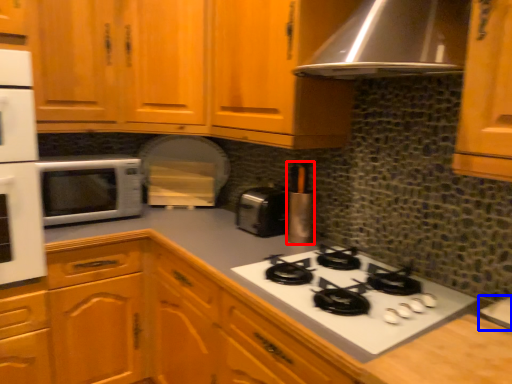
Question: Which object appears closest to the camera in this image, kitchen appliance (highlighted by a red box) or sink (highlighted by a blue box)?

Choices:
 (A) kitchen appliance
 (B) sink

Answer: (B)